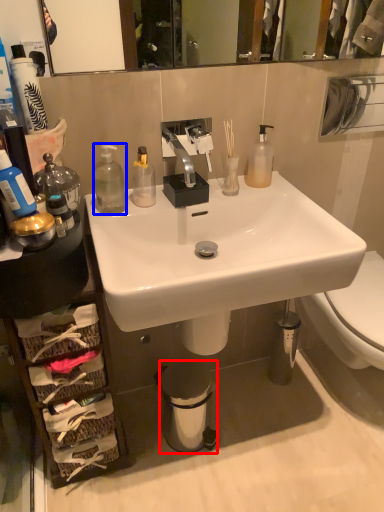
Question: Which of the following is the closest to the observer, trash bin/can (highlighted by a red box) or bottle (highlighted by a blue box)?

Choices:
 (A) trash bin/can
 (B) bottle

Answer: (B)